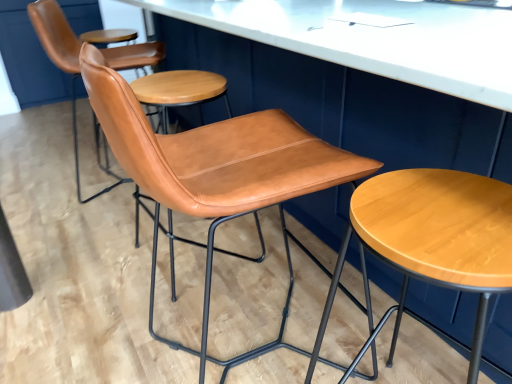
Locate an element on the screen. free space to the left of cognac leather chair at center, the second chair viewed from the front is located at coordinates (94, 263).